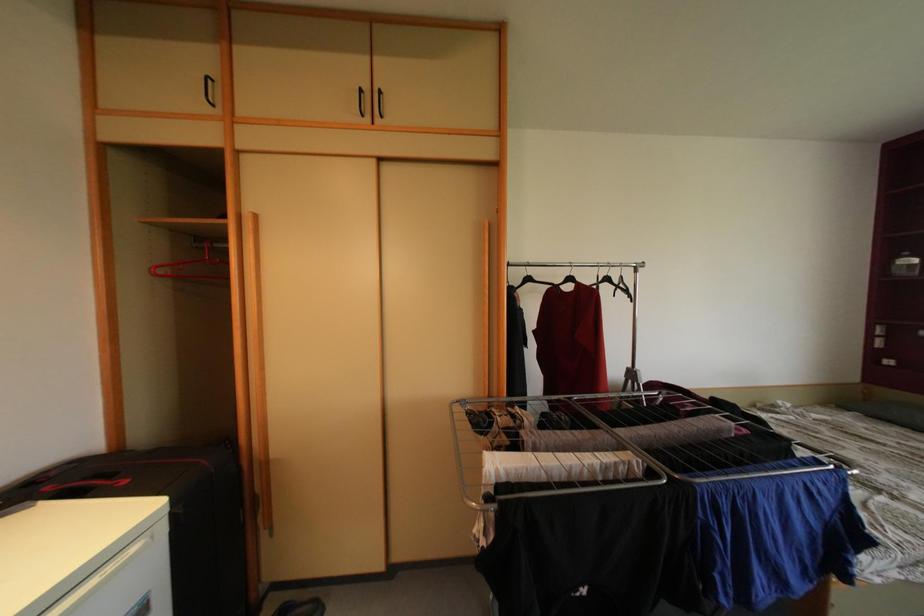
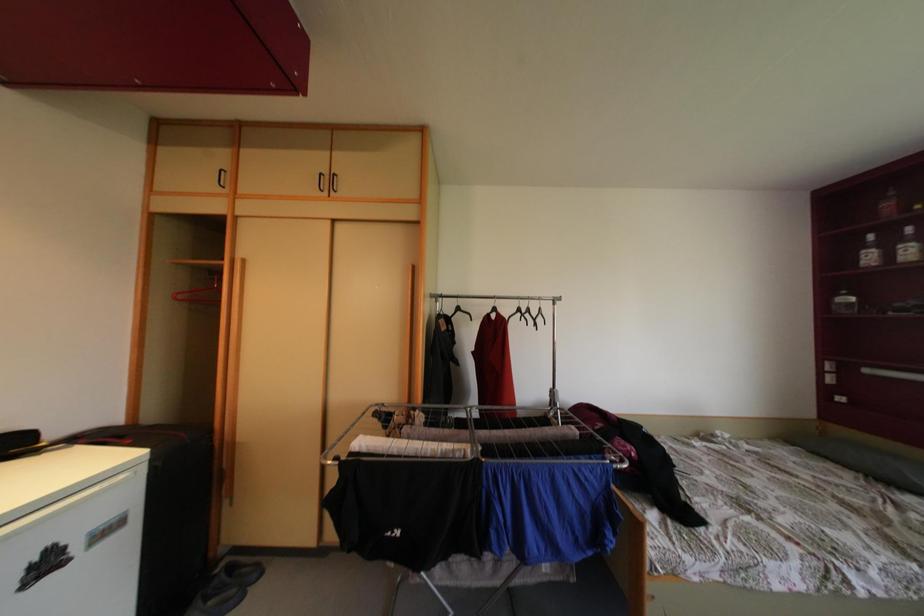
Which direction would the cameraman need to move to produce the second image?

The cameraman walked toward right, backward.